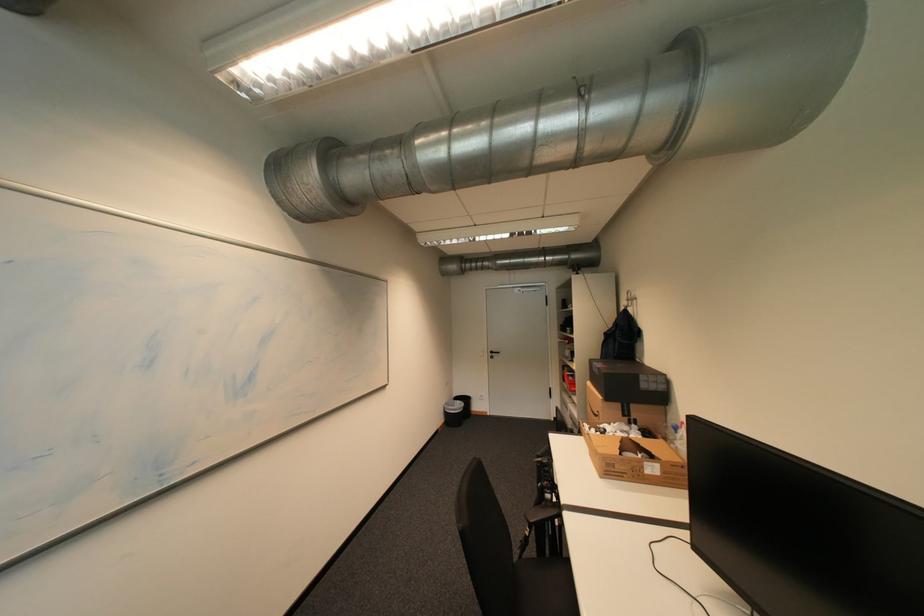
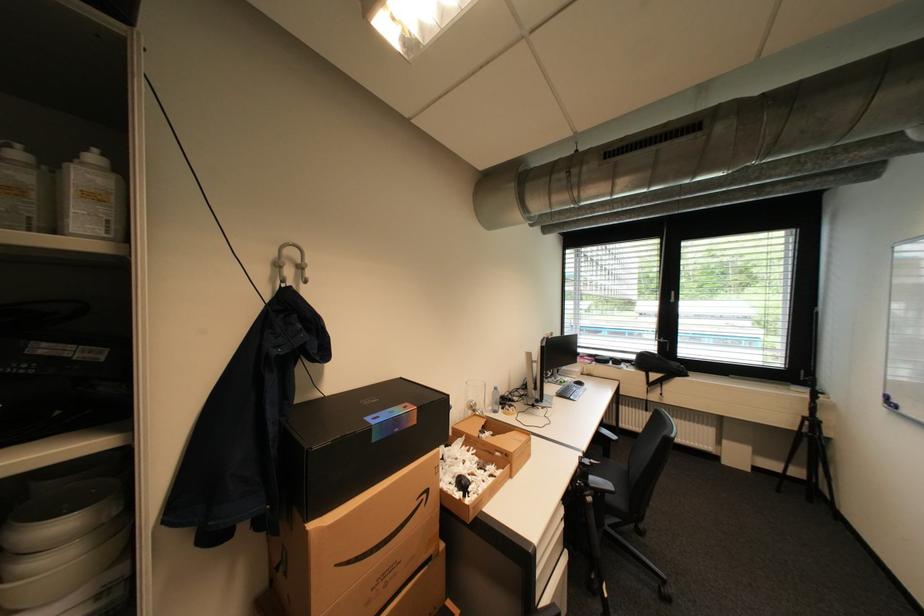
The point at (x=660, y=454) is marked in the first image. Where is the corresponding point in the second image?

(492, 426)